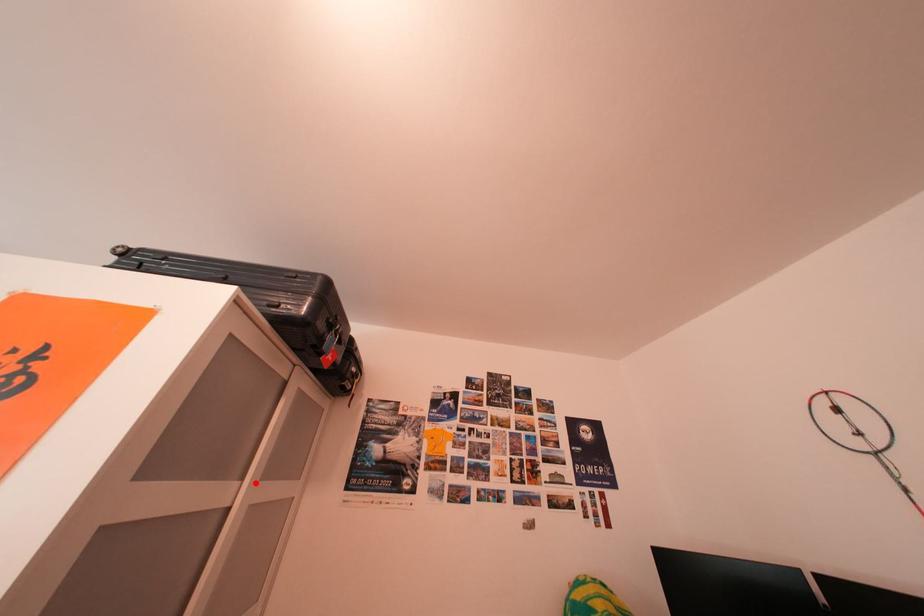
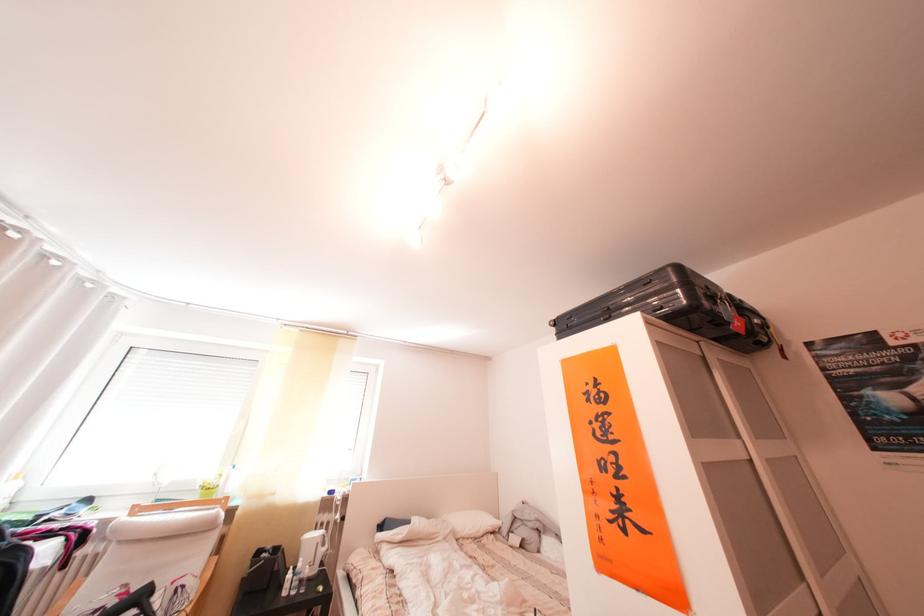
Locate, in the second image, the point that corresponds to the highlighted location in the first image.

(751, 442)